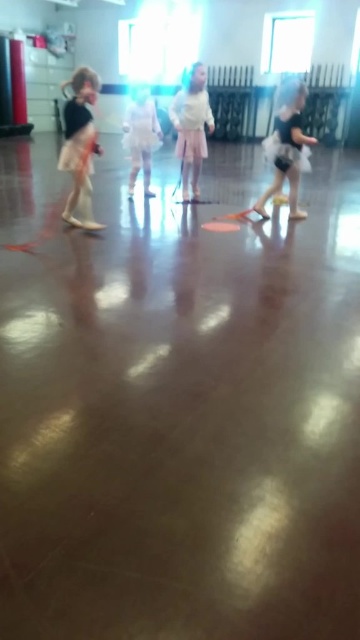
Question: Does white cotton dress at center have a larger size compared to white satin dress at center?

Choices:
 (A) yes
 (B) no

Answer: (B)

Question: Is white cotton dress at center below white satin dress at right?

Choices:
 (A) yes
 (B) no

Answer: (B)

Question: Among these objects, which one is farthest from the camera?

Choices:
 (A) white cotton dress at center
 (B) white satin dress at center

Answer: (B)

Question: Can you confirm if matte black tutu at left is positioned to the right of white cotton dress at center?

Choices:
 (A) no
 (B) yes

Answer: (A)

Question: Which point appears closest to the camera in this image?

Choices:
 (A) [x=299, y=120]
 (B) [x=267, y=193]

Answer: (A)

Question: Estimate the real-world distances between objects in this image. Which object is farther from the black tulle skirt at right?

Choices:
 (A) matte black tutu at left
 (B) white cotton dress at center

Answer: (A)